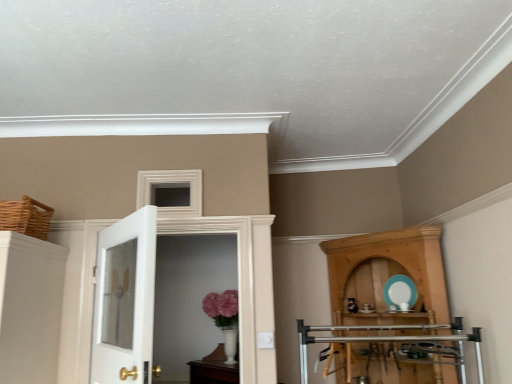
Question: Should I look upward or downward to see wooden cupboard at right?

Choices:
 (A) up
 (B) down

Answer: (B)

Question: Is white glass door at left, arranged as the 2th door when viewed from the back, aimed at white glossy door at center, acting as the 1th door starting from the back?

Choices:
 (A) yes
 (B) no

Answer: (A)

Question: From a real-world perspective, is white glass door at left, arranged as the 2th door when viewed from the back, located beneath white glossy door at center, placed as the 2th door when sorted from front to back?

Choices:
 (A) no
 (B) yes

Answer: (B)

Question: Is white glass door at left, arranged as the 2th door when viewed from the back, taller than white glossy door at center, acting as the 1th door starting from the back?

Choices:
 (A) no
 (B) yes

Answer: (A)

Question: Is white glossy door at center, placed as the 2th door when sorted from front to back, located within white glass door at left, arranged as the 2th door when viewed from the back?

Choices:
 (A) yes
 (B) no

Answer: (B)

Question: Does white glass door at left, the 1th door from the front, have a lesser height compared to white glossy door at center, placed as the 2th door when sorted from front to back?

Choices:
 (A) yes
 (B) no

Answer: (A)

Question: Is white glass door at left, the 1th door from the front, directly adjacent to white glossy door at center, acting as the 1th door starting from the back?

Choices:
 (A) yes
 (B) no

Answer: (B)

Question: Could you tell me if white glossy door at center, acting as the 1th door starting from the back, is facing woven brown basket at upper left?

Choices:
 (A) no
 (B) yes

Answer: (A)

Question: Is white glossy door at center, acting as the 1th door starting from the back, with woven brown basket at upper left?

Choices:
 (A) no
 (B) yes

Answer: (A)

Question: Is white glossy door at center, acting as the 1th door starting from the back, to the left of woven brown basket at upper left from the viewer's perspective?

Choices:
 (A) no
 (B) yes

Answer: (A)

Question: Can woven brown basket at upper left be found inside white glossy door at center, placed as the 2th door when sorted from front to back?

Choices:
 (A) yes
 (B) no

Answer: (B)

Question: Does white glossy door at center, acting as the 1th door starting from the back, have a lesser width compared to woven brown basket at upper left?

Choices:
 (A) yes
 (B) no

Answer: (A)

Question: From the image's perspective, is white glossy door at center, placed as the 2th door when sorted from front to back, located above woven brown basket at upper left?

Choices:
 (A) yes
 (B) no

Answer: (B)

Question: Can you confirm if woven brown basket at upper left is taller than wooden cupboard at right?

Choices:
 (A) no
 (B) yes

Answer: (A)